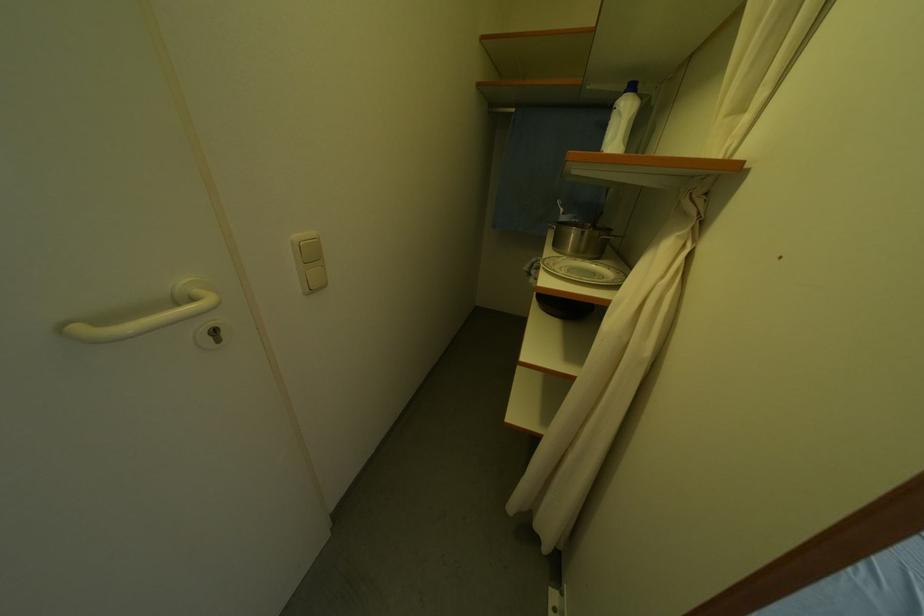
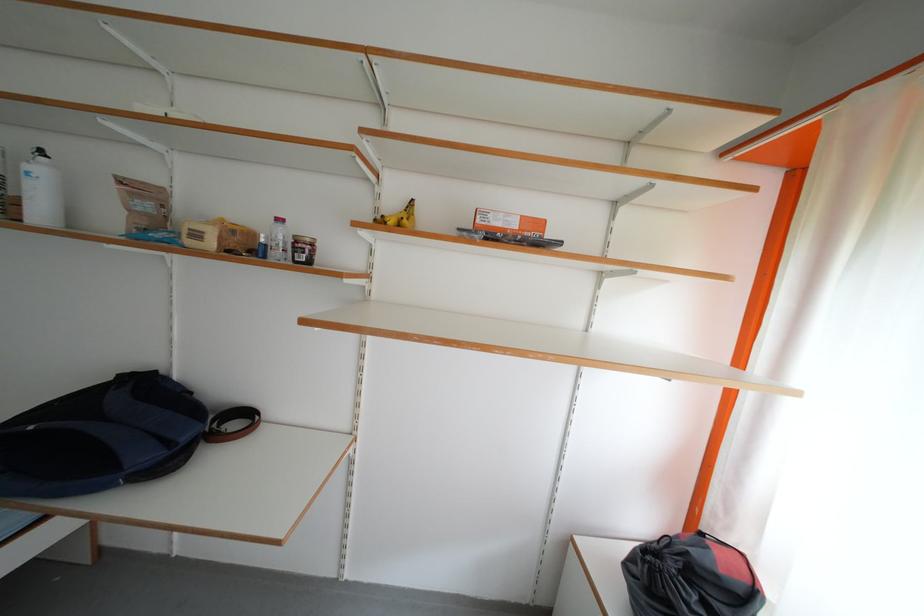
Question: Which direction would the cameraman need to move to produce the second image? Reply with the corresponding letter.

Choices:
 (A) Left
 (B) Right
 (C) Forward
 (D) Backward

Answer: (B)